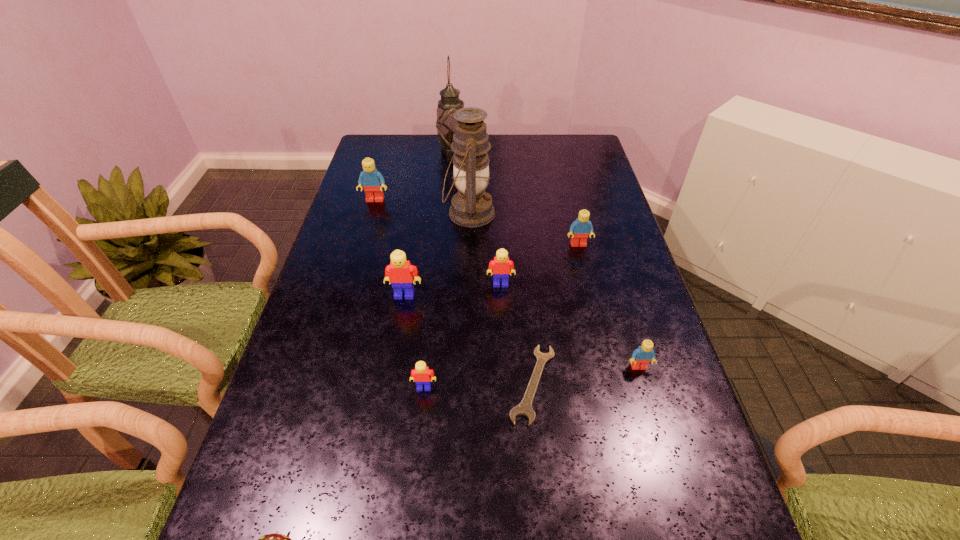
Locate an element on the screen. This screenshot has height=540, width=960. free space between the blue oil lamp and the wrench is located at coordinates (501, 299).

The height and width of the screenshot is (540, 960). Identify the location of vacant space that's between the leftmost blue Lego and the second biggest yellow Lego. (438, 242).

Where is `free area in between the blue oil lamp and the second smallest yellow Lego`? This screenshot has height=540, width=960. free area in between the blue oil lamp and the second smallest yellow Lego is located at coordinates (485, 248).

The width and height of the screenshot is (960, 540). In order to click on vacant area between the smallest blue Lego and the wrench in this screenshot , I will do `click(586, 375)`.

Find the location of a particular element. This screenshot has height=540, width=960. unoccupied position between the biggest yellow Lego and the farthest Lego is located at coordinates (390, 247).

Identify the location of free spot between the sixth farthest object and the nearest blue Lego. (521, 331).

Locate an element on the screen. The height and width of the screenshot is (540, 960). object that is the sixth closest to the nearest blue Lego is located at coordinates (471, 206).

Identify the location of object that can be found as the third closest to the nearest yellow Lego. (501, 265).

Choose which Lego is the third nearest neighbor to the second biggest blue Lego. Please provide its 2D coordinates. Your answer should be formatted as a tuple, i.e. [(x, y)], where the tuple contains the x and y coordinates of a point satisfying the conditions above.

[(400, 273)]

Identify which Lego is located as the third nearest to the seventh nearest object. Please provide its 2D coordinates. Your answer should be formatted as a tuple, i.e. [(x, y)], where the tuple contains the x and y coordinates of a point satisfying the conditions above.

[(400, 273)]